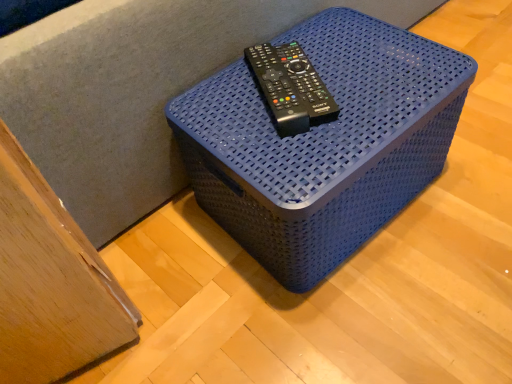
What do you see at coordinates (290, 88) in the screenshot?
I see `black plastic remote control at center` at bounding box center [290, 88].

Where is `black plastic remote control at center`? black plastic remote control at center is located at coordinates (290, 88).

Describe the element at coordinates (323, 143) in the screenshot. This screenshot has height=384, width=512. I see `blue woven basket at center` at that location.

Locate an element on the screen. blue woven basket at center is located at coordinates 323,143.

Identify the location of black plastic remote control at center. (290, 88).

Based on their positions, is blue woven basket at center located to the left or right of black plastic remote control at center?

Clearly, blue woven basket at center is on the right of black plastic remote control at center in the image.

Consider the image. Does blue woven basket at center lie in front of black plastic remote control at center?

Yes, blue woven basket at center is closer to the camera.

Which is more distant, (266, 132) or (260, 54)?

The point (260, 54) is farther from the camera.

From the image's perspective, which object appears higher, blue woven basket at center or black plastic remote control at center?

black plastic remote control at center, from the image's perspective.

From a real-world perspective, is blue woven basket at center positioned above or below black plastic remote control at center?

In terms of real-world spatial position, blue woven basket at center is below black plastic remote control at center.

Which of these two, blue woven basket at center or black plastic remote control at center, is thinner?

black plastic remote control at center.

From the picture: Is blue woven basket at center taller than black plastic remote control at center?

Yes, blue woven basket at center is taller than black plastic remote control at center.

Can you confirm if blue woven basket at center is smaller than black plastic remote control at center?

No, blue woven basket at center is not smaller than black plastic remote control at center.

Consider the image. Is blue woven basket at center completely or partially outside of black plastic remote control at center?

Yes, blue woven basket at center is outside of black plastic remote control at center.

Are blue woven basket at center and black plastic remote control at center located far from each other?

No, blue woven basket at center is not far away from black plastic remote control at center.

Could you tell me if blue woven basket at center is turned towards black plastic remote control at center?

No, blue woven basket at center is not aimed at black plastic remote control at center.

Find the location of a particular element. The height and width of the screenshot is (384, 512). equipment located above the blue woven basket at center (from the image's perspective) is located at coordinates (290, 88).

Consider the image. Is black plastic remote control at center to the left or to the right of blue woven basket at center in the image?

black plastic remote control at center is to the left of blue woven basket at center.

Which is behind, black plastic remote control at center or blue woven basket at center?

black plastic remote control at center is more distant.

Which is behind, point (300, 79) or point (261, 107)?

The point (261, 107) is farther.

From the image's perspective, would you say black plastic remote control at center is shown under blue woven basket at center?

No, from the image's perspective, black plastic remote control at center is not beneath blue woven basket at center.

From a real-world perspective, is black plastic remote control at center located beneath blue woven basket at center?

No, from a real-world perspective, black plastic remote control at center is not beneath blue woven basket at center.

Between black plastic remote control at center and blue woven basket at center, which one has larger width?

blue woven basket at center.

Considering the sizes of black plastic remote control at center and blue woven basket at center in the image, is black plastic remote control at center taller or shorter than blue woven basket at center?

black plastic remote control at center is shorter than blue woven basket at center.

Considering the sizes of objects black plastic remote control at center and blue woven basket at center in the image provided, who is bigger, black plastic remote control at center or blue woven basket at center?

Bigger between the two is blue woven basket at center.

Is blue woven basket at center surrounded by black plastic remote control at center?

No.

Would you consider black plastic remote control at center to be distant from blue woven basket at center?

black plastic remote control at center is actually quite close to blue woven basket at center.

Is black plastic remote control at center oriented away from blue woven basket at center?

No, black plastic remote control at center's orientation is not away from blue woven basket at center.

What's the angular difference between black plastic remote control at center and blue woven basket at center's facing directions?

The facing directions of black plastic remote control at center and blue woven basket at center are 28.1 degrees apart.

Image resolution: width=512 pixels, height=384 pixels. What are the coordinates of `furniture on the right side of black plastic remote control at center` in the screenshot? It's located at (323, 143).

The image size is (512, 384). I want to click on furniture that appears below the black plastic remote control at center (from the image's perspective), so click(323, 143).

In the image, there is a blue woven basket at center. Where is `equipment above it (from the image's perspective)`? Image resolution: width=512 pixels, height=384 pixels. equipment above it (from the image's perspective) is located at coordinates (290, 88).